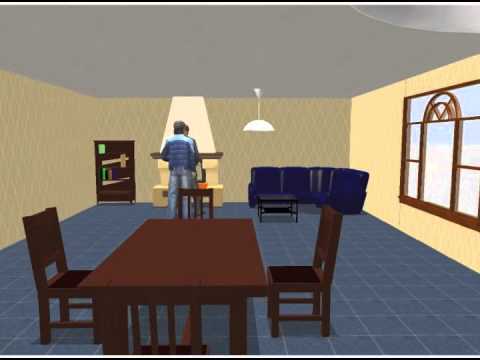
The image size is (480, 360). In order to click on corner in this screenshot , I will do `click(347, 151)`.